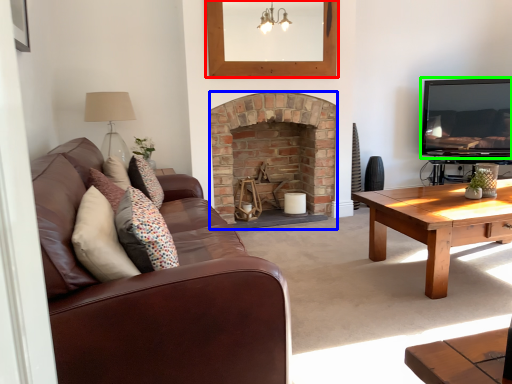
Question: Estimate the real-world distances between objects in this image. Which object is closer to picture frame (highlighted by a red box), fireplace (highlighted by a blue box) or television (highlighted by a green box)?

Choices:
 (A) fireplace
 (B) television

Answer: (A)